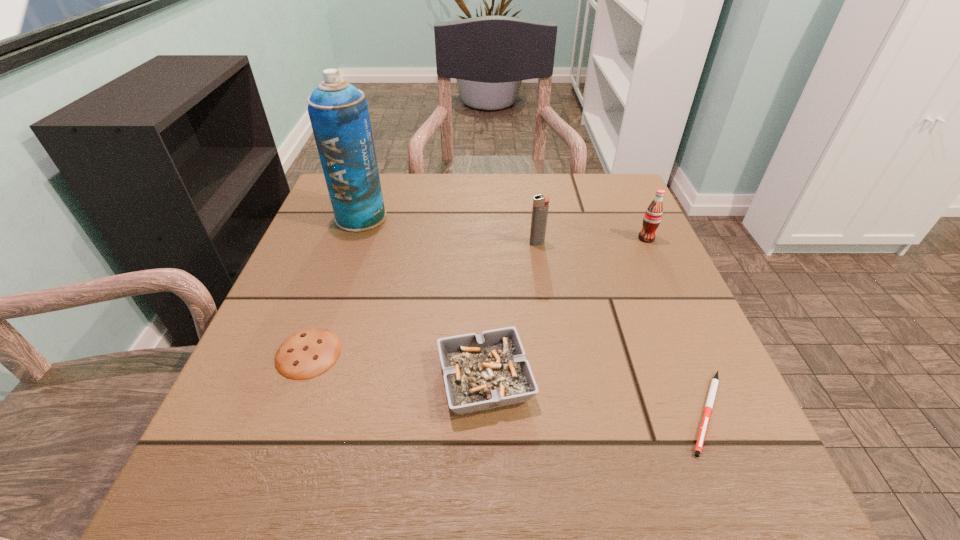
The height and width of the screenshot is (540, 960). Identify the location of the farthest object. (338, 111).

Where is `the tallest object`? The image size is (960, 540). the tallest object is located at coordinates tap(338, 111).

Locate an element on the screen. soda is located at coordinates (653, 215).

Where is `igniter`? The width and height of the screenshot is (960, 540). igniter is located at coordinates (540, 207).

The width and height of the screenshot is (960, 540). I want to click on the fourth object from right to left, so click(x=485, y=371).

You are a GUI agent. You are given a task and a screenshot of the screen. Output one action in this format:
    pyautogui.click(x=<x>, y=<y>)
    Task: Click on the ashtray
    The height and width of the screenshot is (540, 960).
    Given the screenshot: What is the action you would take?
    pyautogui.click(x=485, y=371)

You are a GUI agent. You are given a task and a screenshot of the screen. Output one action in this format:
    pyautogui.click(x=<x>, y=<y>)
    Task: Click on the cookie
    
    Given the screenshot: What is the action you would take?
    pyautogui.click(x=306, y=354)

Identify the location of pen. The height and width of the screenshot is (540, 960). pos(714,384).

At what (x,y) coordinates should I click in order to perform the action: click on free point located on the back of the farthest object. Please return your answer as a coordinate pair (x, y). Looking at the image, I should click on (372, 186).

In order to click on vacant space situated on the front of the soda in this screenshot , I will do [x=660, y=267].